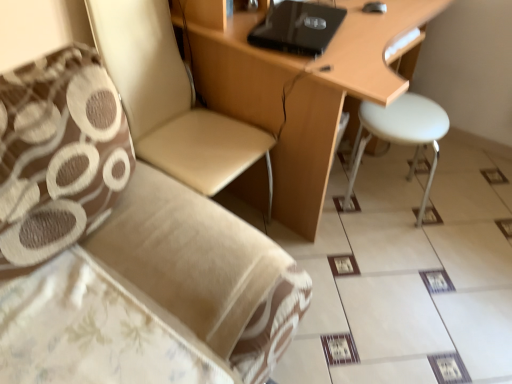
This screenshot has height=384, width=512. I want to click on free space to the back side of white plastic stool at right, so click(388, 161).